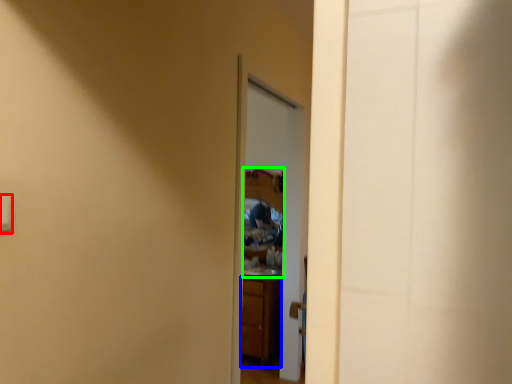
Question: Based on their relative distances, which object is farther from light switch (highlighted by a red box)? Choose from cabinetry (highlighted by a blue box) and mirror (highlighted by a green box).

Choices:
 (A) cabinetry
 (B) mirror

Answer: (B)